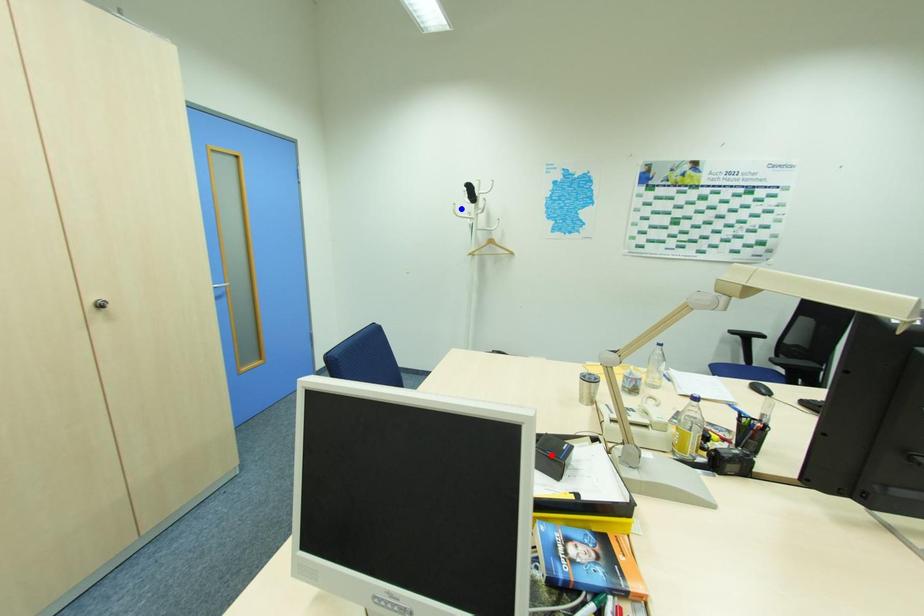
Question: Two points are marked on the image. Which point is closer to the camera?

Choices:
 (A) Blue point is closer.
 (B) Red point is closer.

Answer: (B)